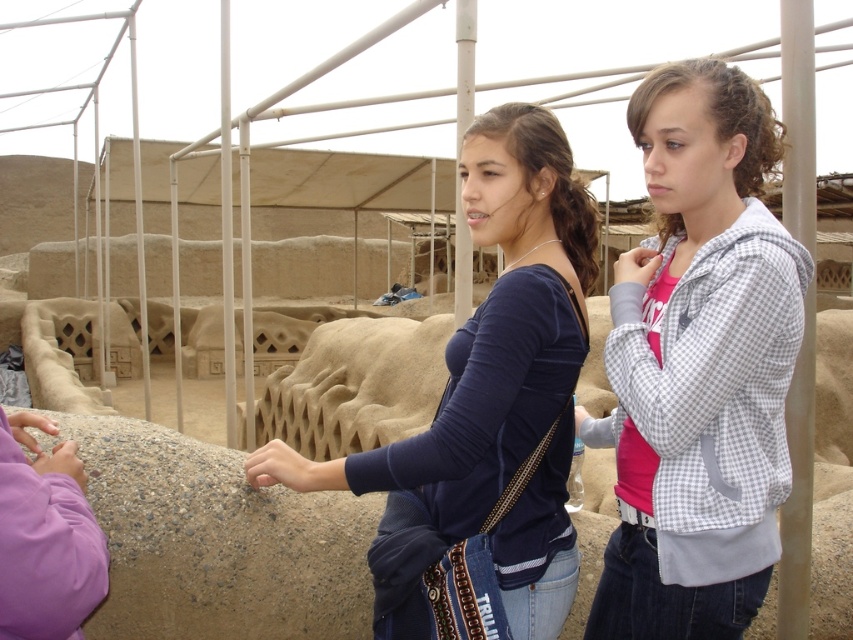
You are a tour guide at an archaeological site. You notice two visitors wearing a white checkered jacket at center and a dark blue jersey at center. Which clothing item is positioned lower on their bodies?

The white checkered jacket at center is located below the dark blue jersey at center, so the white checkered jacket at center is positioned lower on their bodies.

You are a photographer at the archaeological site. You need to capture a photo where both the white checkered jacket at center and the dark blue jersey at center are visible. Given their sizes, which one might appear smaller in the final photo?

The white checkered jacket at center appears smaller in the photo because it has a smaller size compared to the dark blue jersey at center.